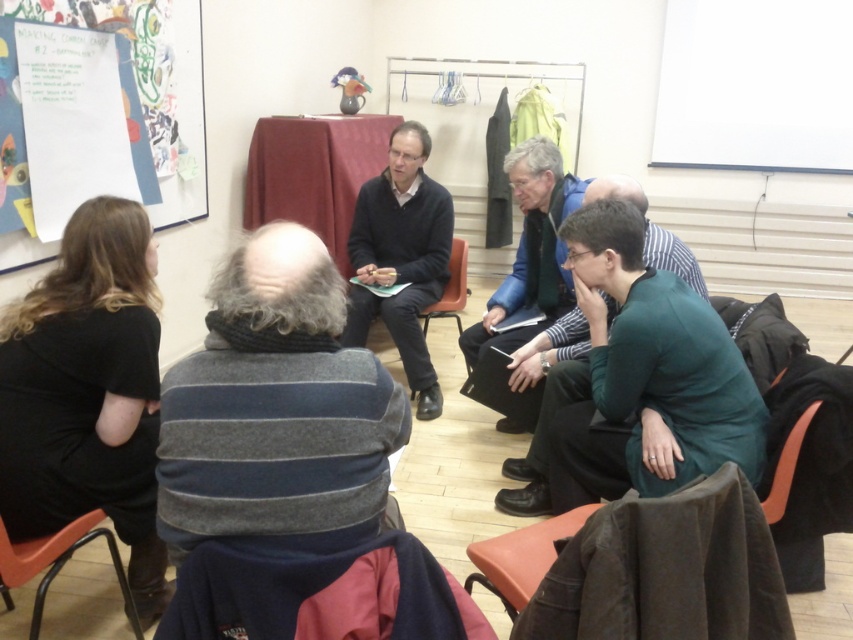
Is point (196, 218) in front of point (19, 544)?

No, (196, 218) is further to viewer.

Between white paper at upper left and orange plastic chair at lower left, which one appears on the right side from the viewer's perspective?

orange plastic chair at lower left is more to the right.

Image resolution: width=853 pixels, height=640 pixels. I want to click on white paper at upper left, so click(152, 84).

What are the coordinates of `white paper at upper left` in the screenshot? It's located at (152, 84).

Who is more distant from viewer, [682,323] or [450,244]?

Point [450,244]

Is green matte shirt at center taller than black matte sweater at center?

In fact, green matte shirt at center may be shorter than black matte sweater at center.

Is point (689, 376) closer to camera compared to point (408, 189)?

Yes, point (689, 376) is closer to viewer.

Identify the location of green matte shirt at center. This screenshot has width=853, height=640. (650, 368).

Can you confirm if orange plastic chair at lower left is wider than orange plastic chair at center?

No, orange plastic chair at lower left is not wider than orange plastic chair at center.

Between point (119, 561) and point (451, 250), which one is positioned behind?

The point (451, 250) is more distant.

This screenshot has height=640, width=853. I want to click on orange plastic chair at lower left, so click(x=57, y=563).

Locate an element on the screen. orange plastic chair at lower left is located at coordinates (57, 563).